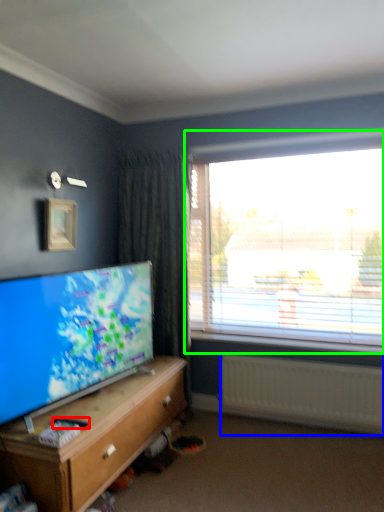
Question: Considering the real-world distances, which object is farthest from remote control (highlighted by a red box)? radiator (highlighted by a blue box) or window (highlighted by a green box)?

Choices:
 (A) radiator
 (B) window

Answer: (B)